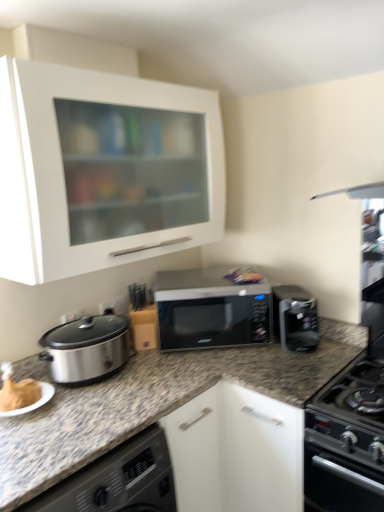
The image size is (384, 512). I want to click on free point to the left of multicolored plastic bag at center, so click(215, 281).